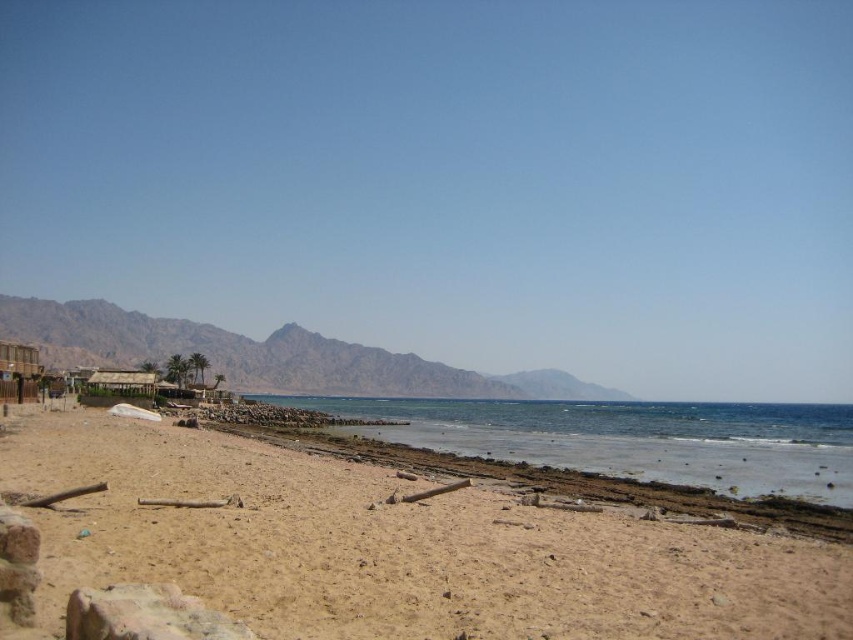
Question: Which of the following is the farthest from the observer?

Choices:
 (A) (312, 570)
 (B) (537, 419)

Answer: (B)

Question: Does brown sandy beach at lower center appear on the right side of rugged brown mountain at center?

Choices:
 (A) yes
 (B) no

Answer: (A)

Question: Is clear blue water at lower center positioned behind rugged brown mountain at center?

Choices:
 (A) yes
 (B) no

Answer: (B)

Question: Among these points, which one is farthest from the camera?

Choices:
 (A) (419, 358)
 (B) (335, 400)
 (C) (827, 576)

Answer: (A)

Question: Which object appears closest to the camera in this image?

Choices:
 (A) clear blue water at lower center
 (B) rugged brown mountain at center

Answer: (A)

Question: Observing the image, what is the correct spatial positioning of clear blue water at lower center in reference to rugged brown mountain at center?

Choices:
 (A) right
 (B) left

Answer: (A)